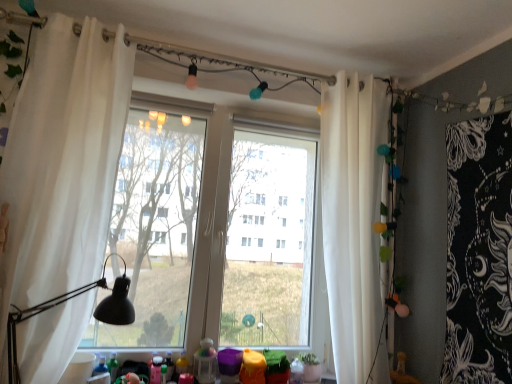
This screenshot has height=384, width=512. In order to click on white sheer curtain at left, marked as the 2th curtain in a right-to-left arrangement in this screenshot , I will do `click(63, 161)`.

This screenshot has height=384, width=512. Find the location of `black matte table lamp at left`. black matte table lamp at left is located at coordinates (67, 300).

Locate an element on the screen. translucent plastic toy at lower center is located at coordinates (205, 362).

Choose the correct answer: Is translucent plastic toy at lower center inside white sheer curtain at left, the 1th curtain from the left, or outside it?

translucent plastic toy at lower center is located beyond the bounds of white sheer curtain at left, the 1th curtain from the left.

Is translucent plastic toy at lower center far from white sheer curtain at left, the first curtain positioned from the front?

Yes, translucent plastic toy at lower center and white sheer curtain at left, the first curtain positioned from the front, are quite far apart.

Is point (197, 356) positioned after point (38, 192)?

That is True.

In the scene shown: From the image's perspective, who appears lower, white sheer curtain at right, marked as the 1th curtain in a back-to-front arrangement, or black matte table lamp at left?

black matte table lamp at left appears lower in the image.

This screenshot has width=512, height=384. There is a black matte table lamp at left. In order to click on the 1st curtain above it (from a real-world perspective) in this screenshot , I will do `click(353, 217)`.

Is point (370, 378) positioned in front of point (25, 317)?

That is False.

Considering the relative sizes of transparent glass window at center and black matte table lamp at left in the image provided, is transparent glass window at center shorter than black matte table lamp at left?

In fact, transparent glass window at center may be taller than black matte table lamp at left.

This screenshot has width=512, height=384. What are the coordinates of `table lamp on the left side of transparent glass window at center` in the screenshot? It's located at (67, 300).

Could you tell me if transparent glass window at center is facing black matte table lamp at left?

Yes, transparent glass window at center is facing black matte table lamp at left.

Considering the relative sizes of white sheer curtain at left, the first curtain positioned from the front, and transparent glass window at center in the image provided, is white sheer curtain at left, the first curtain positioned from the front, taller than transparent glass window at center?

Yes, white sheer curtain at left, the first curtain positioned from the front, is taller than transparent glass window at center.

Find the location of a particular element. This screenshot has width=512, height=384. the 2nd curtain above the transparent glass window at center (from the image's perspective) is located at coordinates (63, 161).

Is white sheer curtain at left, the first curtain positioned from the front, at the left side of transparent glass window at center?

Indeed, white sheer curtain at left, the first curtain positioned from the front, is positioned on the left side of transparent glass window at center.

From the image's perspective, which object appears higher, white sheer curtain at left, the first curtain positioned from the front, or transparent glass window at center?

white sheer curtain at left, the first curtain positioned from the front, from the image's perspective.

Which of these two, white sheer curtain at left, the 1th curtain from the left, or black matte table lamp at left, stands shorter?

Standing shorter between the two is black matte table lamp at left.

Between white sheer curtain at left, the first curtain positioned from the front, and black matte table lamp at left, which one has smaller size?

black matte table lamp at left.

From a real-world perspective, is white sheer curtain at left, the 1th curtain from the left, located higher than black matte table lamp at left?

Correct, in the physical world, white sheer curtain at left, the 1th curtain from the left, is higher than black matte table lamp at left.

Is white sheer curtain at left, which is counted as the second curtain, starting from the back, beside black matte table lamp at left?

No, white sheer curtain at left, which is counted as the second curtain, starting from the back, is not beside black matte table lamp at left.

You are a GUI agent. You are given a task and a screenshot of the screen. Output one action in this format:
    pyautogui.click(x=<x>, y=<y>)
    Task: Click on the 1st curtain above when counting from the transparent glass window at center (from the image's perspective)
    This screenshot has width=512, height=384.
    Given the screenshot: What is the action you would take?
    pyautogui.click(x=353, y=217)

Based on the photo, between white sheer curtain at right, which ranks as the second curtain in front-to-back order, and transparent glass window at center, which one has more height?

Standing taller between the two is white sheer curtain at right, which ranks as the second curtain in front-to-back order.

Is white sheer curtain at right, marked as the 1th curtain in a back-to-front arrangement, looking in the opposite direction of transparent glass window at center?

Yes, white sheer curtain at right, marked as the 1th curtain in a back-to-front arrangement,'s orientation is away from transparent glass window at center.

Which of these two, white sheer curtain at right, marked as the 1th curtain in a back-to-front arrangement, or transparent glass window at center, is wider?

white sheer curtain at right, marked as the 1th curtain in a back-to-front arrangement.

In the scene shown: Is translucent plastic toy at lower center at the back of black matte table lamp at left?

No, black matte table lamp at left is not facing the opposite direction of translucent plastic toy at lower center.

Between black matte table lamp at left and translucent plastic toy at lower center, which one appears on the right side from the viewer's perspective?

Positioned to the right is translucent plastic toy at lower center.

From the image's perspective, is black matte table lamp at left above or below translucent plastic toy at lower center?

Based on their image positions, black matte table lamp at left is located above translucent plastic toy at lower center.

Identify the location of toy beneath the white sheer curtain at left, which is counted as the second curtain, starting from the back (from a real-world perspective). (205, 362).

At what (x,y) coordinates should I click in order to perform the action: click on curtain on the right of black matte table lamp at left. Please return your answer as a coordinate pair (x, y). The height and width of the screenshot is (384, 512). Looking at the image, I should click on (353, 217).

Which object lies nearer to the anchor point transparent glass window at center, translucent plastic toy at lower center or black matte table lamp at left?

translucent plastic toy at lower center is positioned closer to the anchor transparent glass window at center.

When comparing their distances from transparent glass window at center, does translucent plastic toy at lower center or white sheer curtain at left, the 1th curtain from the left, seem closer?

translucent plastic toy at lower center.

From the picture: Estimate the real-world distances between objects in this image. Which object is further from black matte table lamp at left, white sheer curtain at right, marked as the 1th curtain in a back-to-front arrangement, or white sheer curtain at left, the first curtain positioned from the front?

white sheer curtain at right, marked as the 1th curtain in a back-to-front arrangement, is positioned further to the anchor black matte table lamp at left.

Considering their positions, is white sheer curtain at left, marked as the 2th curtain in a right-to-left arrangement, positioned closer to white sheer curtain at right, the first curtain positioned from the right, than transparent glass window at center?

white sheer curtain at left, marked as the 2th curtain in a right-to-left arrangement.

Looking at the image, which one is located closer to white sheer curtain at right, marked as the second curtain in a left-to-right arrangement, black matte table lamp at left or transparent glass window at center?

The object closer to white sheer curtain at right, marked as the second curtain in a left-to-right arrangement, is black matte table lamp at left.

Looking at the image, which one is located closer to white sheer curtain at right, marked as the 1th curtain in a back-to-front arrangement, translucent plastic toy at lower center or white sheer curtain at left, the first curtain positioned from the front?

Based on the image, translucent plastic toy at lower center appears to be nearer to white sheer curtain at right, marked as the 1th curtain in a back-to-front arrangement.

Looking at the image, which one is located further to white sheer curtain at right, marked as the second curtain in a left-to-right arrangement, transparent glass window at center or translucent plastic toy at lower center?

transparent glass window at center lies further to white sheer curtain at right, marked as the second curtain in a left-to-right arrangement, than the other object.

When comparing their distances from white sheer curtain at right, which ranks as the second curtain in front-to-back order, does white sheer curtain at left, marked as the 2th curtain in a right-to-left arrangement, or black matte table lamp at left seem closer?

black matte table lamp at left is positioned closer to the anchor white sheer curtain at right, which ranks as the second curtain in front-to-back order.

The image size is (512, 384). I want to click on window between translucent plastic toy at lower center and white sheer curtain at right, the first curtain positioned from the right, in the horizontal direction, so click(213, 235).

You are a GUI agent. You are given a task and a screenshot of the screen. Output one action in this format:
    pyautogui.click(x=<x>, y=<y>)
    Task: Click on the toy located between white sheer curtain at left, marked as the 2th curtain in a right-to-left arrangement, and white sheer curtain at right, the first curtain positioned from the right, in the left-right direction
    The image size is (512, 384).
    Given the screenshot: What is the action you would take?
    pyautogui.click(x=205, y=362)

Where is `table lamp between white sheer curtain at left, the first curtain positioned from the front, and white sheer curtain at right, marked as the 1th curtain in a back-to-front arrangement, in the horizontal direction`? Image resolution: width=512 pixels, height=384 pixels. table lamp between white sheer curtain at left, the first curtain positioned from the front, and white sheer curtain at right, marked as the 1th curtain in a back-to-front arrangement, in the horizontal direction is located at coordinates (67, 300).

This screenshot has height=384, width=512. I want to click on table lamp between white sheer curtain at left, the first curtain positioned from the front, and transparent glass window at center, so click(x=67, y=300).